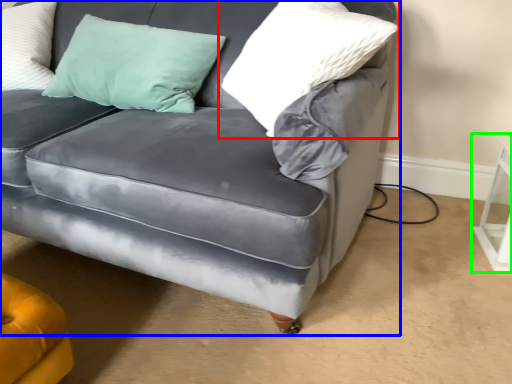
Question: Which object is the closest to the pillow (highlighted by a red box)? Choose among these: studio couch (highlighted by a blue box) or table (highlighted by a green box).

Choices:
 (A) studio couch
 (B) table

Answer: (A)